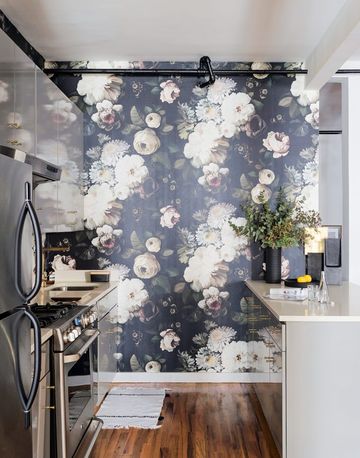
Identify the location of handle of oven door. (78, 355).